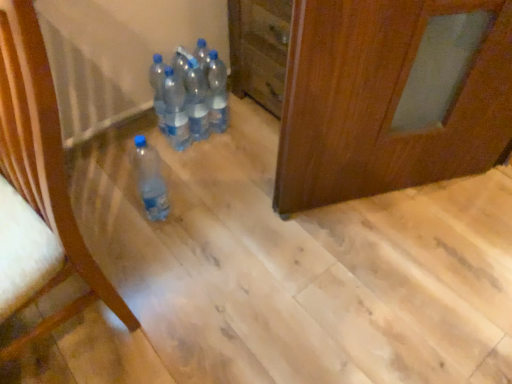
Where is `free space to the left of translucent plastic bottle at lower left, acting as the 4th bottle starting from the right`? The image size is (512, 384). free space to the left of translucent plastic bottle at lower left, acting as the 4th bottle starting from the right is located at coordinates (111, 208).